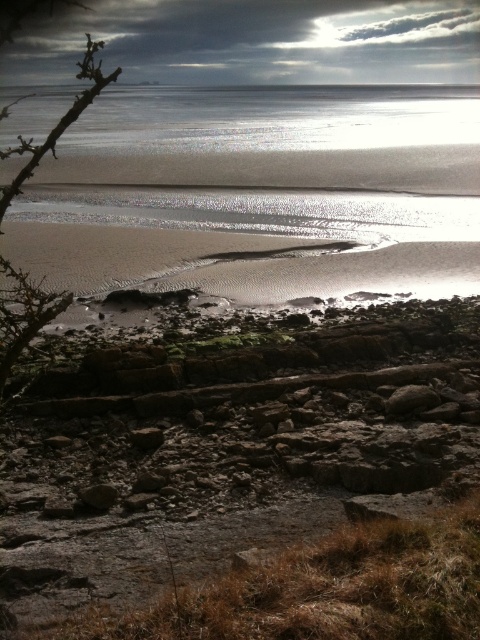
You are a photographer setting up equipment on the beach. You have a shiny metallic water at upper center and a brown thorny branch at left in your viewfinder. Which object will appear smaller in your photo?

The shiny metallic water at upper center will appear smaller because it is shorter than the brown thorny branch at left.

You are a photographer planning to capture the entire scene in one shot. Considering the positions and sizes of the shiny metallic water at upper center and the brown thorny branch at left, which object should you prioritize framing closer to ensure both are visible in the photo?

Since the shiny metallic water at upper center occupies less space than the brown thorny branch at left, you should prioritize framing the shiny metallic water at upper center closer to ensure both objects are visible in the photo.

From the picture: You are a hiker who wants to take a photo of the shiny metallic water at upper center and the brown thorny branch at left. Which object should you focus on first to ensure both are in the frame?

You should focus on the shiny metallic water at upper center first because it is closer to you than the brown thorny branch at left, so adjusting the camera to include it will also capture the branch in the background.